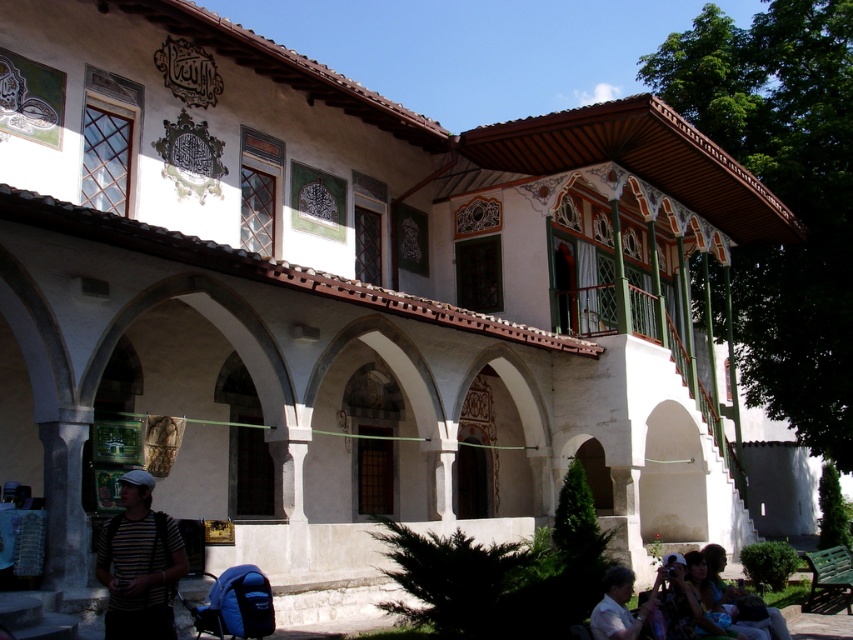
Who is more forward, (105,554) or (602,624)?

Point (105,554) is in front.

Identify the location of striped fabric shirt at lower left. The width and height of the screenshot is (853, 640). (138, 564).

Is point (138, 508) more distant than point (639, 632)?

No, (138, 508) is closer to viewer.

Identify the location of striped fabric shirt at lower left. (138, 564).

Looking at this image, who is taller, striped fabric shirt at lower left or matte black shirt at lower right?

With more height is matte black shirt at lower right.

Who is more forward, (132, 627) or (735, 589)?

Point (132, 627)

This screenshot has width=853, height=640. In order to click on striped fabric shirt at lower left in this screenshot , I will do `click(138, 564)`.

Does light brown leather jacket at lower right appear over matte black shirt at lower right?

Yes, light brown leather jacket at lower right is above matte black shirt at lower right.

Does light brown leather jacket at lower right come behind matte black shirt at lower right?

No.

Who is more forward, (622, 589) or (724, 589)?

Point (622, 589)

The height and width of the screenshot is (640, 853). Find the location of `light brown leather jacket at lower right`. light brown leather jacket at lower right is located at coordinates (618, 608).